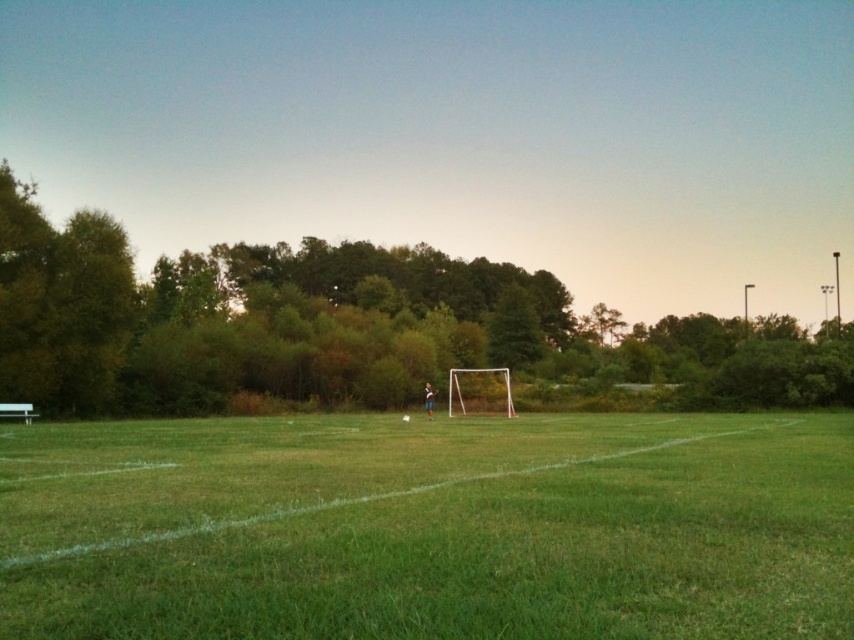
Between point (545, 637) and point (451, 316), which one is positioned behind?

The point (451, 316) is more distant.

Which is in front, point (109, 637) or point (226, 324)?

Point (109, 637) is more forward.

The height and width of the screenshot is (640, 854). I want to click on green grass at center, so click(430, 528).

Is green leafy tree at center to the right of white plastic goal at center from the viewer's perspective?

Yes, green leafy tree at center is to the right of white plastic goal at center.

Is green leafy tree at center above white plastic goal at center?

Yes, green leafy tree at center is above white plastic goal at center.

The height and width of the screenshot is (640, 854). Find the location of `green leafy tree at center`. green leafy tree at center is located at coordinates (346, 326).

Where is `green leafy tree at center`? The height and width of the screenshot is (640, 854). green leafy tree at center is located at coordinates (346, 326).

Is green grass at center bigger than white plastic goal at center?

Correct, green grass at center is larger in size than white plastic goal at center.

Between point (576, 538) and point (488, 390), which one is positioned in front?

Point (576, 538) is in front.

In order to click on green grass at center in this screenshot , I will do `click(430, 528)`.